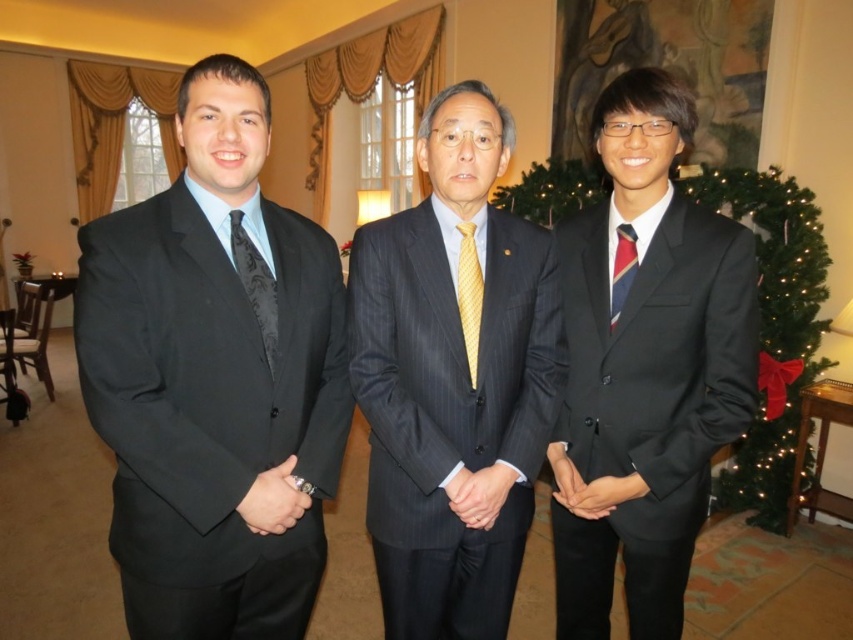
Is matte black suit at right positioned behind black satin tie at left?

Yes.

Who is more distant from viewer, [590,314] or [257,257]?

The point [590,314] is behind.

At what (x,y) coordinates should I click in order to perform the action: click on matte black suit at right. Please return your answer as a coordinate pair (x, y). Looking at the image, I should click on (645, 369).

Does point (509, 461) come behind point (706, 282)?

No, (509, 461) is closer to viewer.

Where is `dark gray pinstripe suit at center`? dark gray pinstripe suit at center is located at coordinates (453, 381).

Find the location of a particular element. The height and width of the screenshot is (640, 853). dark gray pinstripe suit at center is located at coordinates (453, 381).

Can you confirm if matte black suit at left is positioned below yellow silk tie at center?

Correct, matte black suit at left is located below yellow silk tie at center.

I want to click on matte black suit at left, so click(215, 380).

Is point (248, 86) farther from viewer compared to point (468, 346)?

No.

Where is `matte black suit at left`? Image resolution: width=853 pixels, height=640 pixels. matte black suit at left is located at coordinates (215, 380).